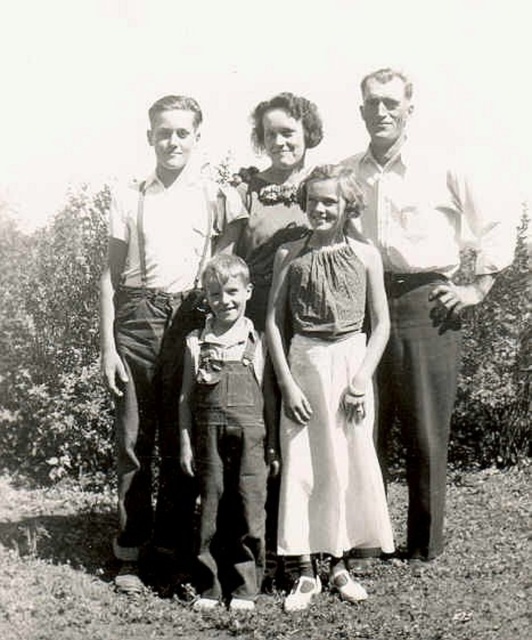
Does point (117, 355) come in front of point (405, 211)?

Yes, it is in front of point (405, 211).

The width and height of the screenshot is (532, 640). In order to click on white cotton shirt at left in this screenshot , I will do `click(157, 330)`.

Who is positioned more to the left, textured white dress at center or white cotton shirt at left?

white cotton shirt at left is more to the left.

This screenshot has width=532, height=640. I want to click on textured white dress at center, so click(328, 388).

Is point (330, 563) less distant than point (162, 490)?

Yes, it is.

You are a GUI agent. You are given a task and a screenshot of the screen. Output one action in this format:
    pyautogui.click(x=<x>, y=<y>)
    Task: Click on the textured white dress at center
    The image size is (532, 640).
    Given the screenshot: What is the action you would take?
    pyautogui.click(x=328, y=388)

Is textured white dress at center smaller than denim overalls at center?

No.

Who is positioned more to the left, textured white dress at center or denim overalls at center?

Positioned to the left is denim overalls at center.

This screenshot has width=532, height=640. Find the location of `textured white dress at center`. textured white dress at center is located at coordinates (328, 388).

The image size is (532, 640). In order to click on textured white dress at center in this screenshot , I will do click(328, 388).